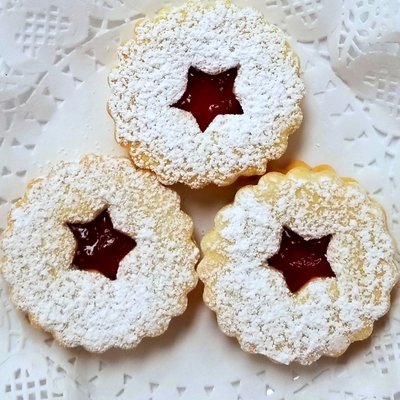
This screenshot has height=400, width=400. Identify the location of doily. tap(360, 382), tap(372, 131), tap(30, 382), tap(43, 63).